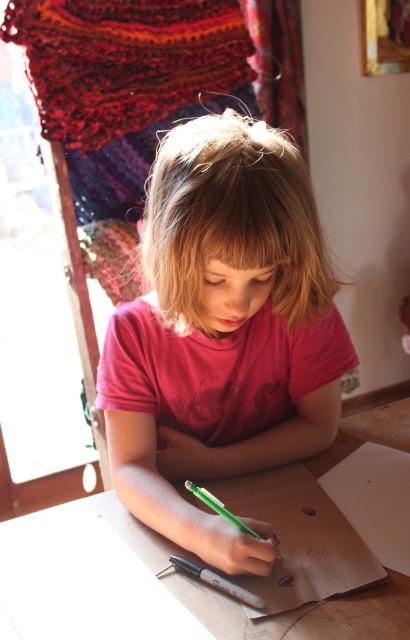
You are a photographer trying to capture the child and their drawing setup. You need to ensure both the pink matte shirt at center and the green plastic pencil at lower center are clearly visible in the photo. Considering their sizes, which object might require you to adjust your camera angle to avoid being too small in the frame?

The green plastic pencil at lower center is much smaller than the pink matte shirt at center, so it might require adjusting the camera angle to ensure it is not too small in the frame.